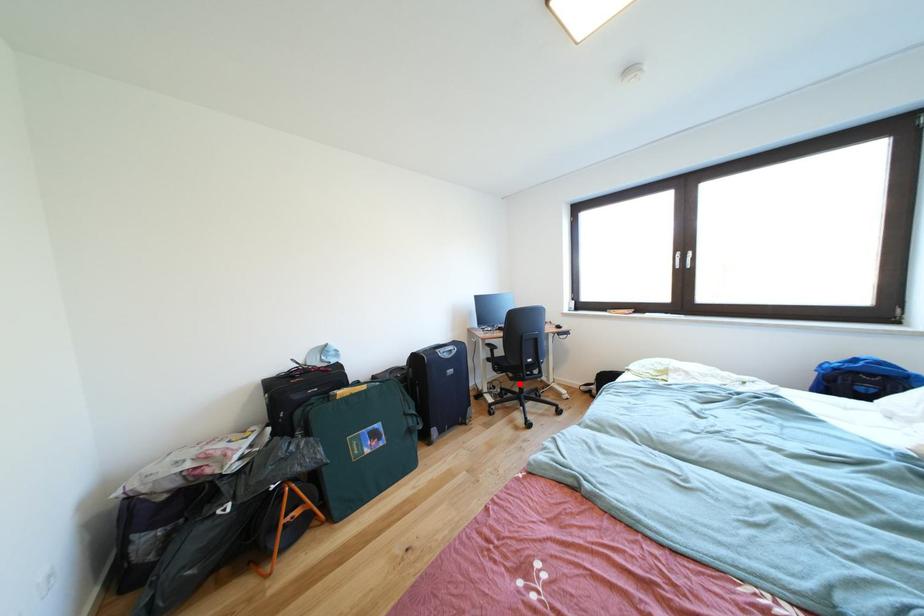
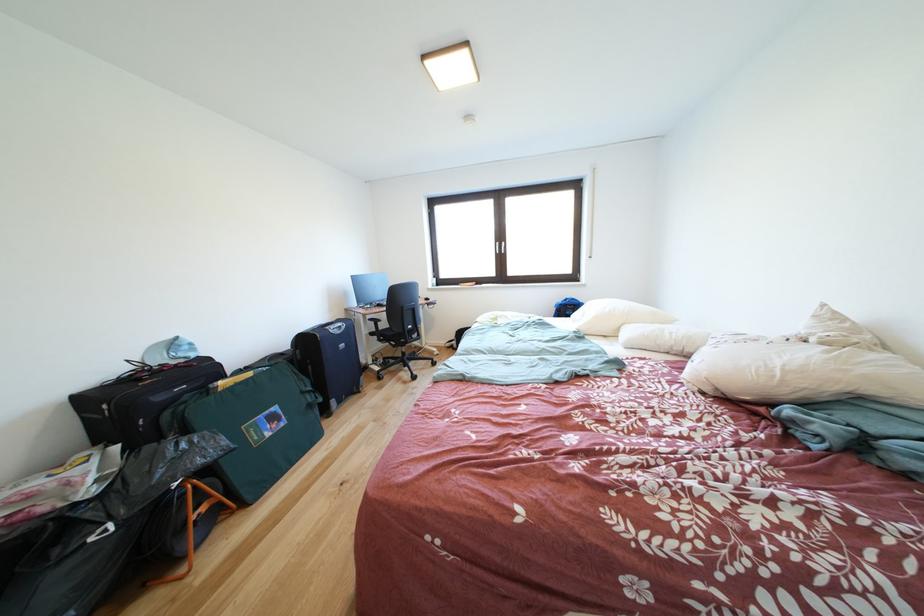
Where in the second image is the point corresponding to the highlighted location from the first image?

(403, 351)